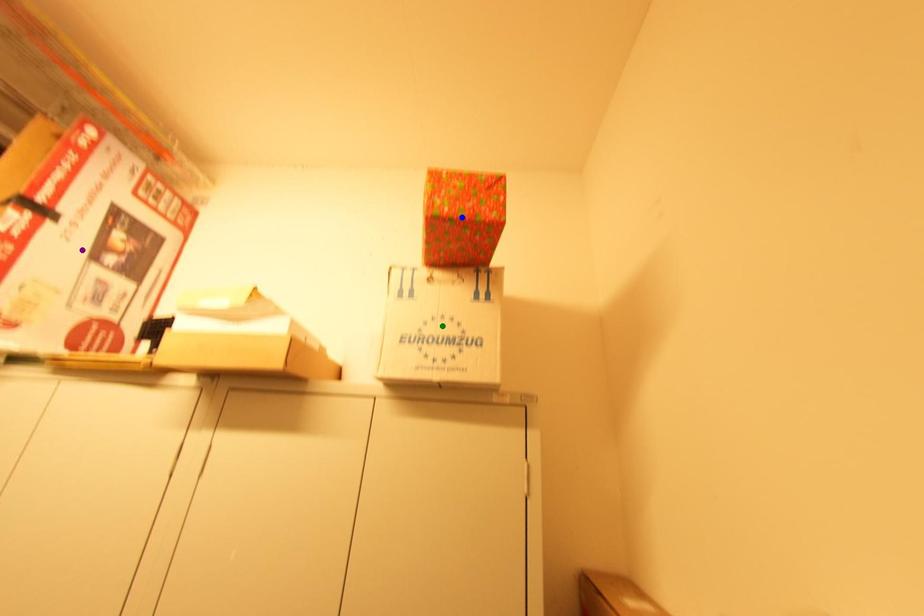
Order these from nearest to farthest:
- purple point
- blue point
- green point

blue point, green point, purple point